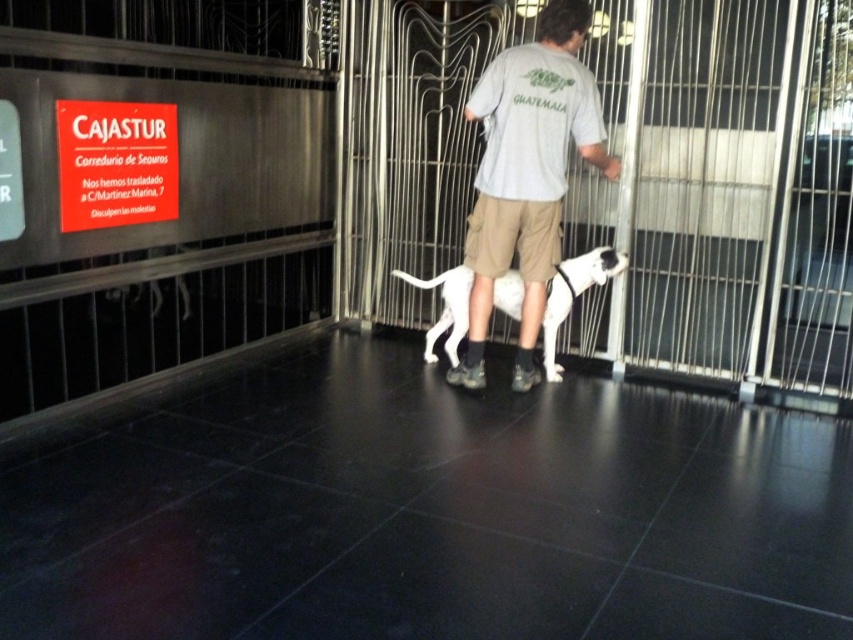
Question: Which point appears closest to the camera in this image?

Choices:
 (A) (451, 282)
 (B) (482, 250)
 (C) (648, 228)
 (D) (88, 120)

Answer: (D)

Question: Does light gray t-shirt at center have a smaller size compared to red plastic sign at upper left?

Choices:
 (A) no
 (B) yes

Answer: (A)

Question: Which object is the farthest from the red plastic sign at upper left?

Choices:
 (A) white fur dog at center
 (B) metallic silver cage at center
 (C) light gray t-shirt at center

Answer: (B)

Question: Is red plastic sign at upper left further to the viewer compared to white fur dog at center?

Choices:
 (A) no
 (B) yes

Answer: (A)

Question: Is metallic silver cage at center positioned before white fur dog at center?

Choices:
 (A) no
 (B) yes

Answer: (B)

Question: Which of the following is the farthest from the observer?

Choices:
 (A) metallic silver cage at center
 (B) light gray t-shirt at center

Answer: (A)